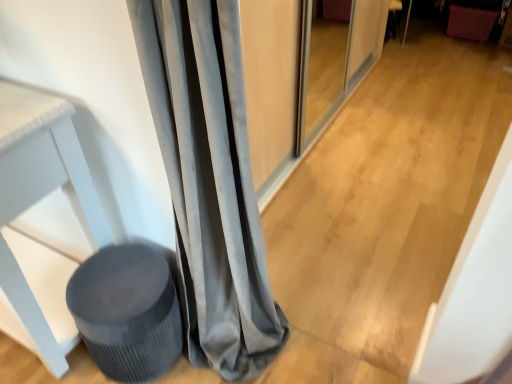
You are a GUI agent. You are given a task and a screenshot of the screen. Output one action in this format:
    pyautogui.click(x=<x>, y=<y>)
    Task: Click on the free spot above matte gray stool at lower left (from a real-world perspective)
    This screenshot has height=384, width=512.
    Given the screenshot: What is the action you would take?
    pyautogui.click(x=117, y=276)